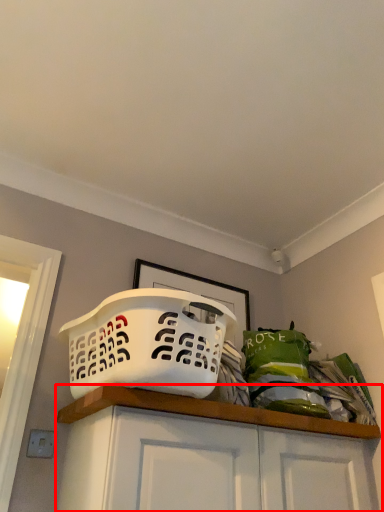
Question: From the image's perspective, what is the correct spatial relationship of cabinetry (annotated by the red box) in relation to basket?

Choices:
 (A) above
 (B) below

Answer: (B)